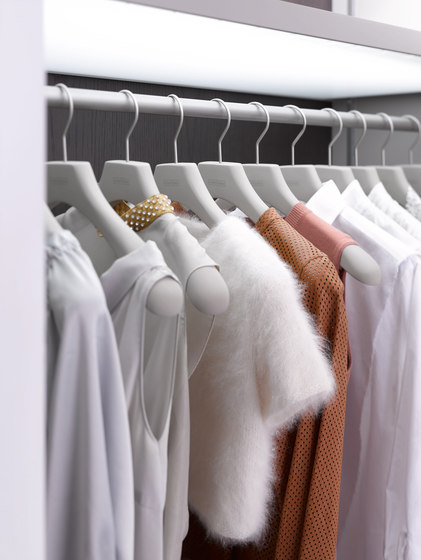
Image resolution: width=421 pixels, height=560 pixels. Identify the location of garments on clothes hangers. (411, 200), (381, 200), (360, 203), (330, 207), (308, 224), (292, 241), (252, 258), (188, 254), (149, 265), (66, 281).